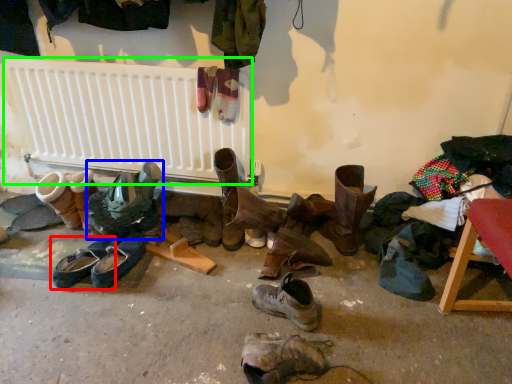
Question: Which is nearer to the footwear (highlighted by a red box)? footwear (highlighted by a blue box) or radiator (highlighted by a green box).

Choices:
 (A) footwear
 (B) radiator

Answer: (A)